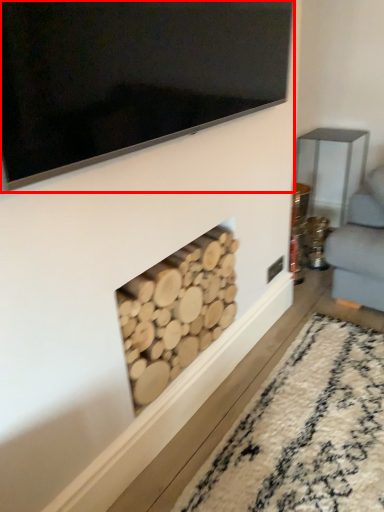
Question: From the image's perspective, what is the correct spatial relationship of television (annotated by the red box) in relation to fireplace?

Choices:
 (A) above
 (B) below

Answer: (A)